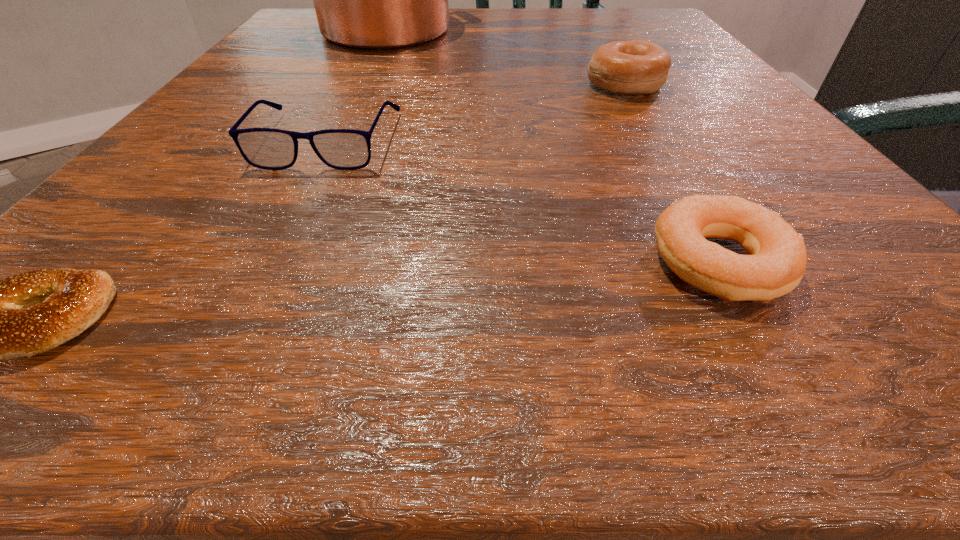
The image size is (960, 540). I want to click on vacant space at the far left corner of the desktop, so click(x=306, y=30).

At what (x,y) coordinates should I click in order to perform the action: click on free space at the far right corner of the desktop. Please return your answer as a coordinate pair (x, y). The height and width of the screenshot is (540, 960). Looking at the image, I should click on click(x=670, y=26).

This screenshot has height=540, width=960. What are the coordinates of `free spot between the third farthest object and the fourth tallest object` in the screenshot? It's located at (524, 201).

The image size is (960, 540). Identify the location of free space between the farthest bagel and the spectacles. (476, 112).

At what (x,y) coordinates should I click in order to perform the action: click on free space between the tallest object and the third farthest object. Please return your answer as a coordinate pair (x, y). This screenshot has height=540, width=960. Looking at the image, I should click on (357, 84).

The image size is (960, 540). What are the coordinates of `free spot between the farthest object and the tallest bagel` in the screenshot? It's located at (505, 57).

In order to click on free space between the second tallest bagel and the spectacles in this screenshot , I will do `click(524, 201)`.

At what (x,y) coordinates should I click in order to perform the action: click on free space that is in between the saucepan and the second farthest object. Please return your answer as a coordinate pair (x, y). This screenshot has height=540, width=960. Looking at the image, I should click on (505, 57).

The image size is (960, 540). Find the location of `unoccupied area between the fourth nearest object and the spectacles`. unoccupied area between the fourth nearest object and the spectacles is located at coordinates (476, 112).

Find the location of a particular element. object that is the closest to the spectacles is located at coordinates (28, 313).